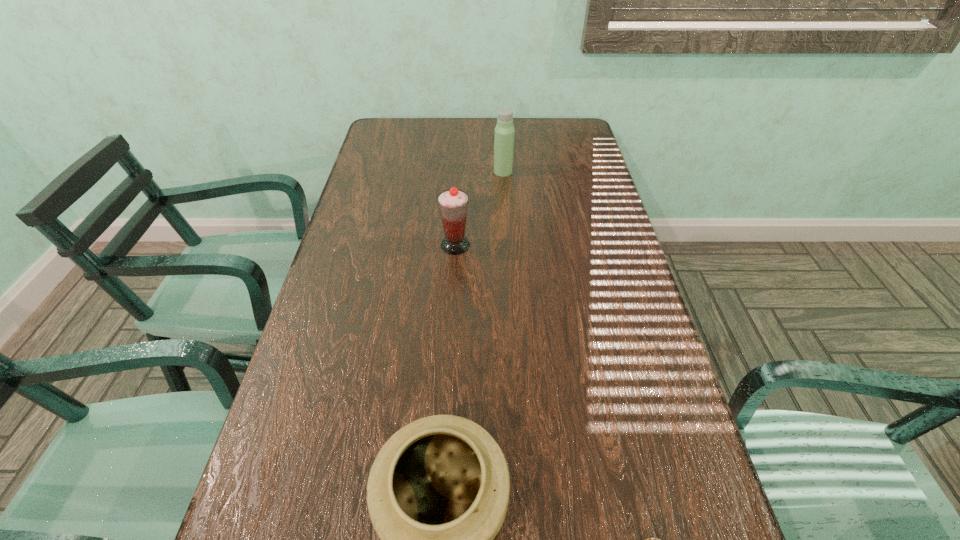
Locate an element on the screen. Image resolution: width=960 pixels, height=540 pixels. thermos bottle is located at coordinates (504, 131).

Find the location of `the second farthest object`. the second farthest object is located at coordinates (453, 203).

This screenshot has width=960, height=540. What are the coordinates of `vacant region located 0.050m on the front of the thermos bottle` in the screenshot? It's located at (504, 186).

The width and height of the screenshot is (960, 540). I want to click on free space located on the back of the third nearest object, so click(461, 160).

I want to click on vacant area at the far edge of the desktop, so coord(463,123).

In the image, there is a desktop. Where is `free space at the left edge`? Image resolution: width=960 pixels, height=540 pixels. free space at the left edge is located at coordinates (394, 170).

The width and height of the screenshot is (960, 540). In the image, there is a desktop. In order to click on vacant area at the right edge in this screenshot , I will do `click(640, 420)`.

At what (x,y) coordinates should I click in order to perform the action: click on vacant position at the far left corner of the desktop. Please return your answer as a coordinate pair (x, y). This screenshot has height=540, width=960. Looking at the image, I should click on (416, 129).

At what (x,y) coordinates should I click in order to perform the action: click on vacant region at the far right corner of the desktop. Please return your answer as a coordinate pair (x, y). Image resolution: width=960 pixels, height=540 pixels. Looking at the image, I should click on (550, 137).

What are the coordinates of `free spot between the thermos bottle and the smoothie` in the screenshot? It's located at (479, 208).